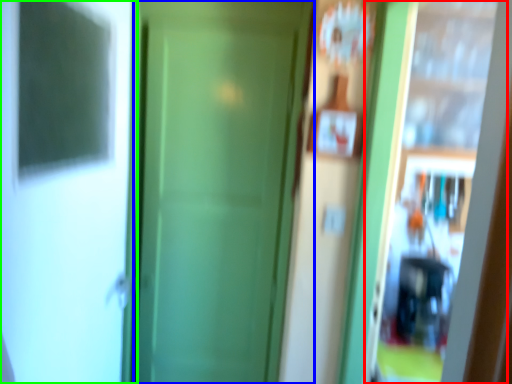
Question: Estimate the real-world distances between objects in this image. Which object is closer to screen door (highlighted by a red box), door (highlighted by a blue box) or screen door (highlighted by a green box)?

Choices:
 (A) door
 (B) screen door

Answer: (A)